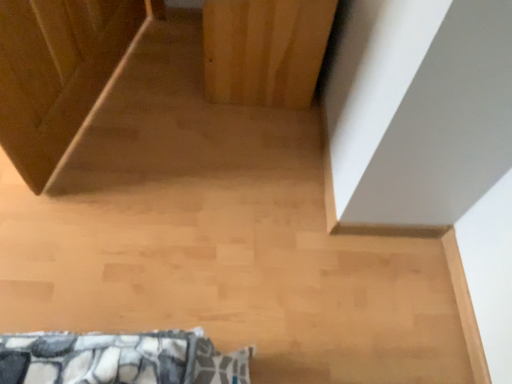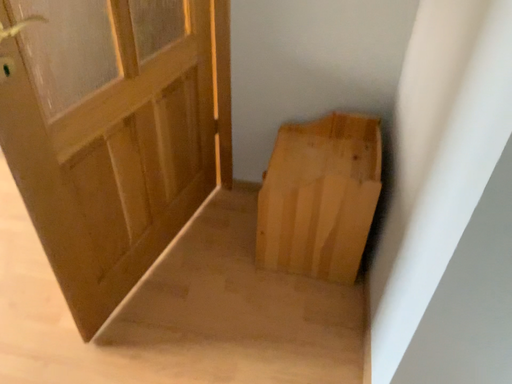
Question: Which way did the camera rotate in the video?

Choices:
 (A) rotated left
 (B) rotated right

Answer: (A)